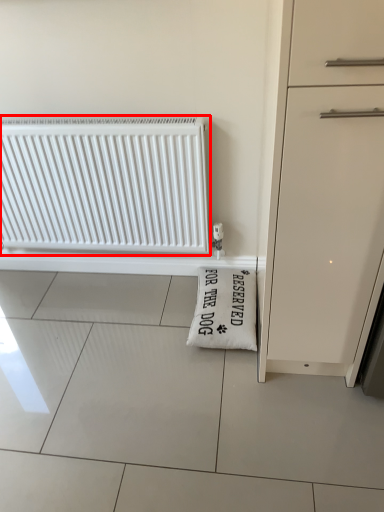
Question: In this image, where is radiator (annotated by the red box) located relative to doormat?

Choices:
 (A) left
 (B) right

Answer: (A)